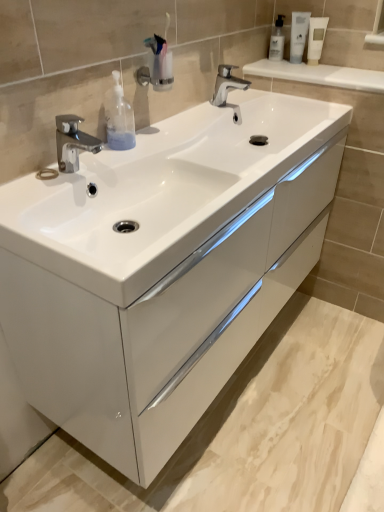
Question: Is white glossy tube at upper right, placed as the 2th mouthwash when sorted from right to left, inside or outside of transparent plastic bottle at left?

Choices:
 (A) inside
 (B) outside

Answer: (B)

Question: Is white glossy tube at upper right, placed as the 2th mouthwash when sorted from right to left, in front of or behind transparent plastic bottle at left in the image?

Choices:
 (A) behind
 (B) front

Answer: (A)

Question: Estimate the real-world distances between objects in this image. Which object is closer to the white glossy tube at upper right, which appears as the 2th mouthwash when viewed from the left?

Choices:
 (A) white matte tube at upper right, the first mouthwash viewed from the right
 (B) transparent plastic bottle at left
 (C) polished chrome faucet at center, marked as the 2th tap in a bottom-to-top arrangement
 (D) white glossy sink at center
 (E) white glossy cabinet at center

Answer: (A)

Question: Estimate the real-world distances between objects in this image. Which object is closer to the white glossy cabinet at center?

Choices:
 (A) polished chrome faucet at left, placed as the second tap when sorted from back to front
 (B) clear plastic bottle at upper right, which is the first mouthwash in left-to-right order
 (C) white glossy sink at center
 (D) white matte tube at upper right, positioned as the 3th mouthwash in left-to-right order
 (E) white glossy tube at upper right, placed as the 2th mouthwash when sorted from right to left

Answer: (C)